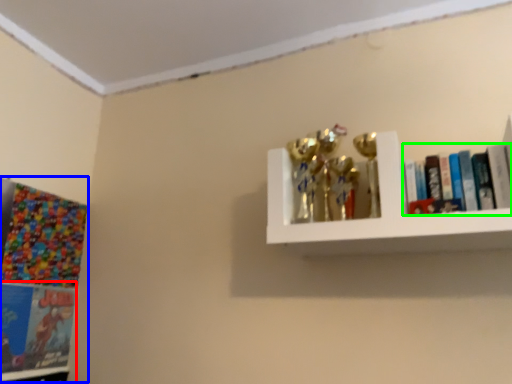
Question: Considering the real-world distances, which object is farthest from book (highlighted by a red box)? comic book (highlighted by a blue box) or book (highlighted by a green box)?

Choices:
 (A) comic book
 (B) book

Answer: (B)